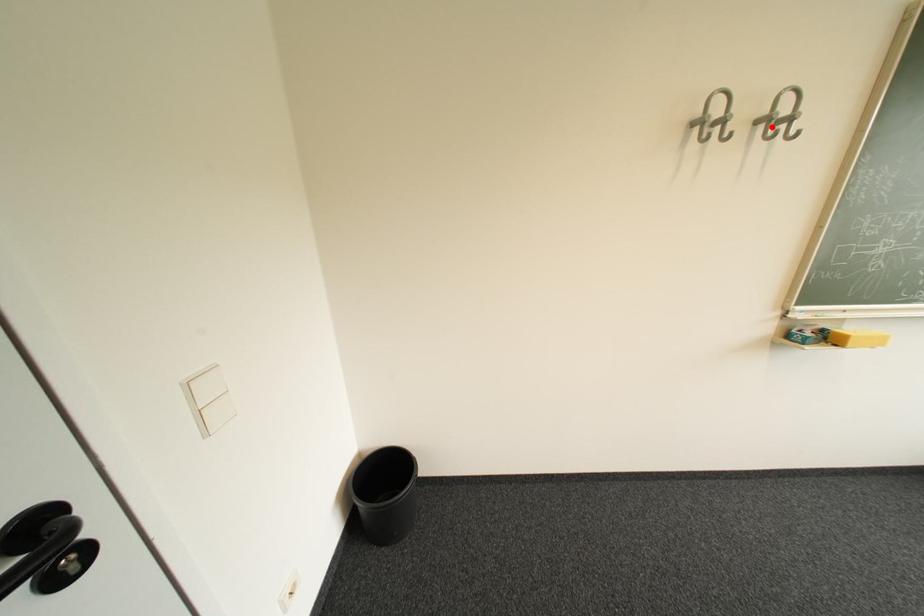
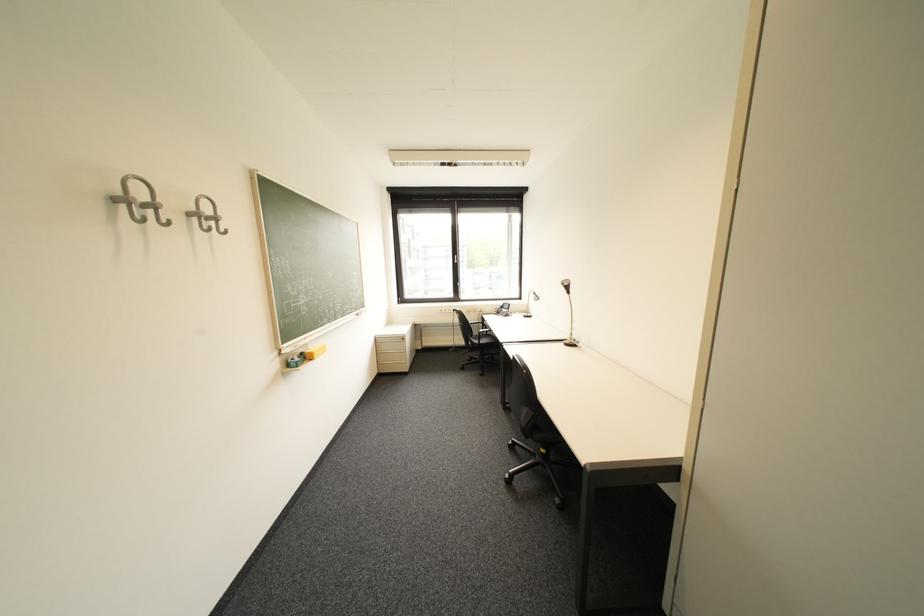
Question: I am providing you with two images of the same scene from different viewpoints. A red point is marked on the first image. Can you still see the location of the red point in image 2?

Choices:
 (A) Yes
 (B) No

Answer: (A)